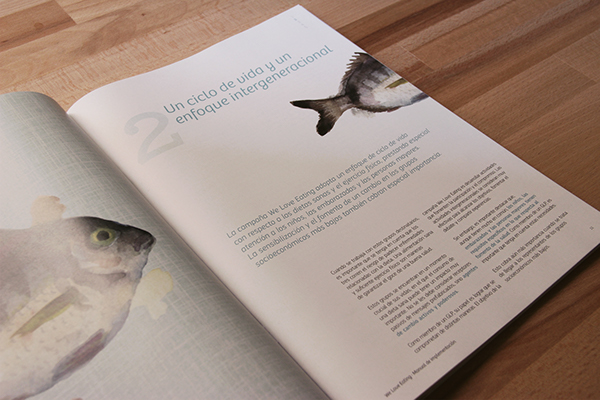
This screenshot has width=600, height=400. What are the coordinates of `table` in the screenshot? It's located at pyautogui.click(x=552, y=348), pyautogui.click(x=566, y=20), pyautogui.click(x=91, y=35).